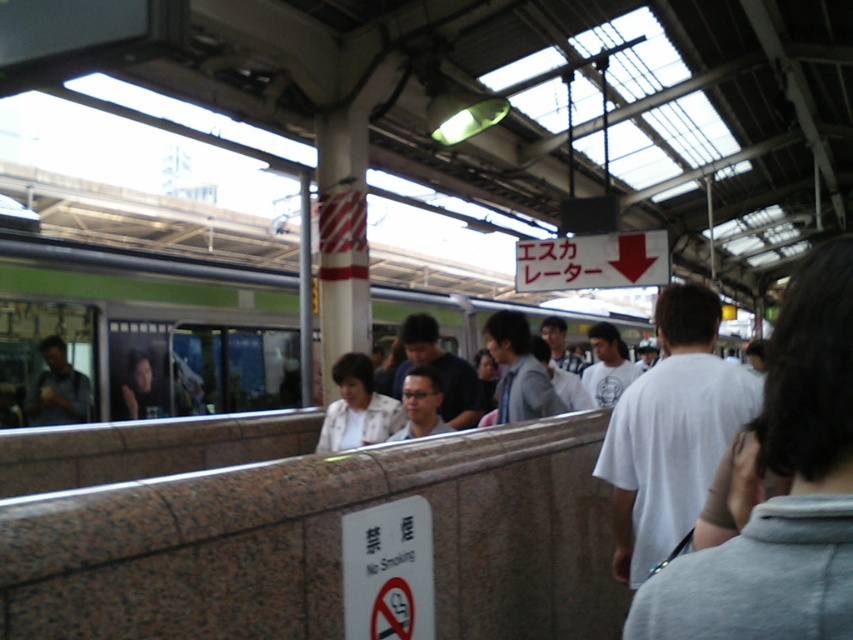
Can you confirm if green metallic train at center is bigger than white textured jacket at center?

Indeed, green metallic train at center has a larger size compared to white textured jacket at center.

This screenshot has width=853, height=640. Describe the element at coordinates (151, 308) in the screenshot. I see `green metallic train at center` at that location.

At what (x,y) coordinates should I click in order to perform the action: click on green metallic train at center. Please return your answer as a coordinate pair (x, y). The image size is (853, 640). Looking at the image, I should click on (151, 308).

Is white textured jacket at center below light gray shirt at center?

Yes, white textured jacket at center is below light gray shirt at center.

Is the position of white textured jacket at center less distant than that of light gray shirt at center?

No, it is not.

Does point (404, 419) lie in front of point (509, 378)?

No.

What are the coordinates of `white textured jacket at center` in the screenshot? It's located at (357, 406).

Between point (32, 212) and point (506, 349), which one is positioned behind?

The point (32, 212) is more distant.

Image resolution: width=853 pixels, height=640 pixels. Describe the element at coordinates (151, 308) in the screenshot. I see `green metallic train at center` at that location.

Find the location of a particular element. The image size is (853, 640). green metallic train at center is located at coordinates (151, 308).

Find the location of `green metallic train at center`. green metallic train at center is located at coordinates (151, 308).